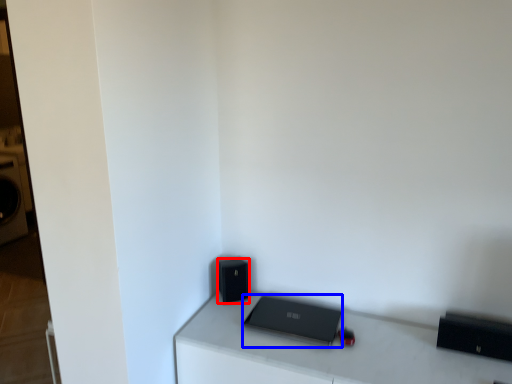
Question: Among these objects, which one is farthest to the camera, speaker (highlighted by a red box) or laptop (highlighted by a blue box)?

Choices:
 (A) speaker
 (B) laptop

Answer: (A)